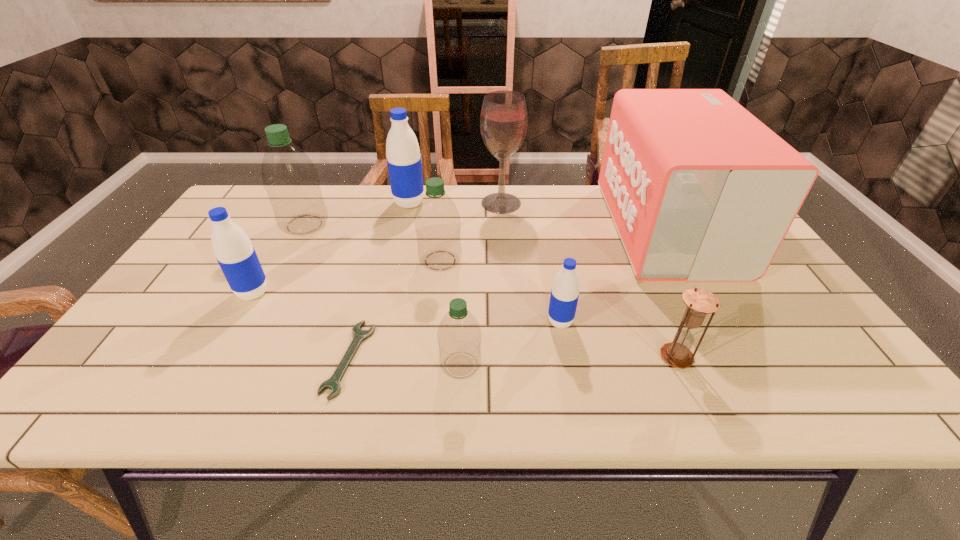
What are the coordinates of `vacant space situated on the right of the fourth water bottle from right to left` in the screenshot? It's located at (478, 203).

You are a GUI agent. You are given a task and a screenshot of the screen. Output one action in this format:
    pyautogui.click(x=<x>, y=<y>)
    Task: Click on the vacant space located on the left of the leftmost green water bottle
    
    Given the screenshot: What is the action you would take?
    pyautogui.click(x=264, y=225)

This screenshot has width=960, height=540. Identify the location of vacant space situated 0.270m on the front of the second smallest green water bottle. (430, 356).

At what (x,y) coordinates should I click in order to perform the action: click on vacant space located on the right of the second nearest blue water bottle. Please return your answer as a coordinate pair (x, y). The height and width of the screenshot is (540, 960). Looking at the image, I should click on (309, 293).

Locate an element on the screen. free space located 0.350m on the left of the smallest blue water bottle is located at coordinates (397, 322).

This screenshot has height=540, width=960. Find the location of `vacant space located on the right of the nearest green water bottle`. vacant space located on the right of the nearest green water bottle is located at coordinates (604, 365).

Where is `vacant space located 0.120m on the back of the brown hourglass`? vacant space located 0.120m on the back of the brown hourglass is located at coordinates (655, 306).

The image size is (960, 540). I want to click on vacant space located on the back of the wrench, so click(x=387, y=225).

The height and width of the screenshot is (540, 960). In order to click on alcohol that is positioned at the far edge in this screenshot , I will do `click(504, 118)`.

Identify the location of box located in the far edge section of the desktop. Image resolution: width=960 pixels, height=540 pixels. (699, 189).